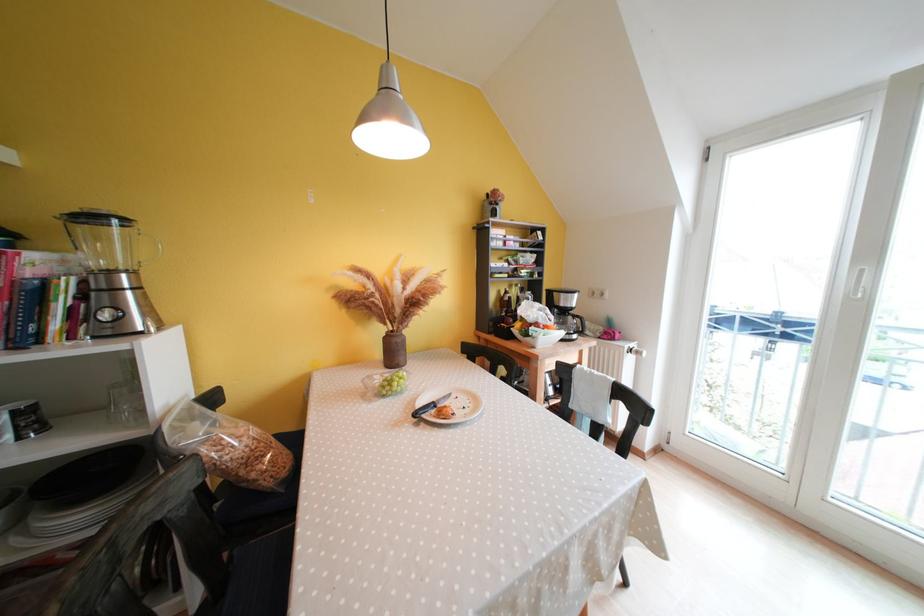
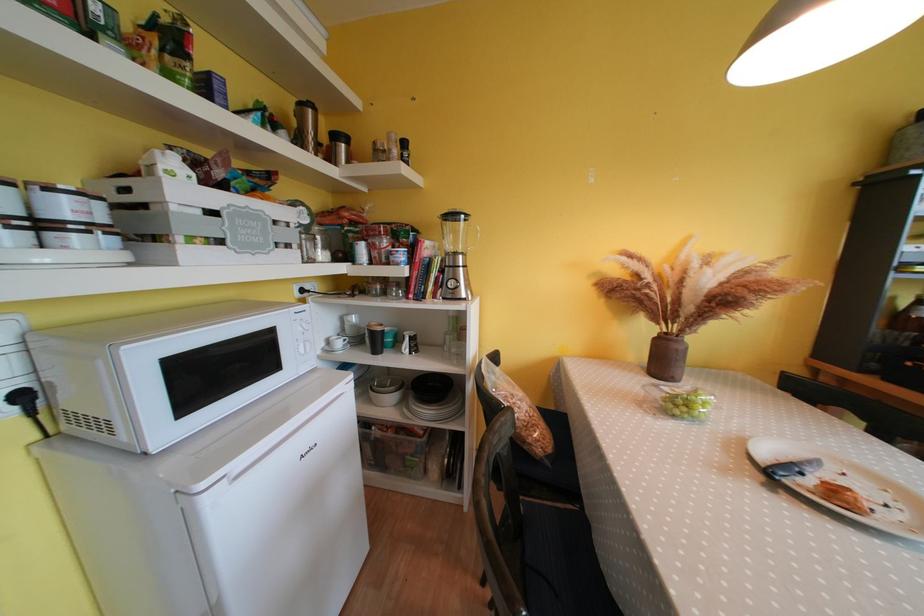
Question: The camera is either moving clockwise (left) or counter-clockwise (right) around the object. The first image is from the beginning of the video and the second image is from the end. Is the camera moving left or right when shooting the video?

Choices:
 (A) Left
 (B) Right

Answer: (B)